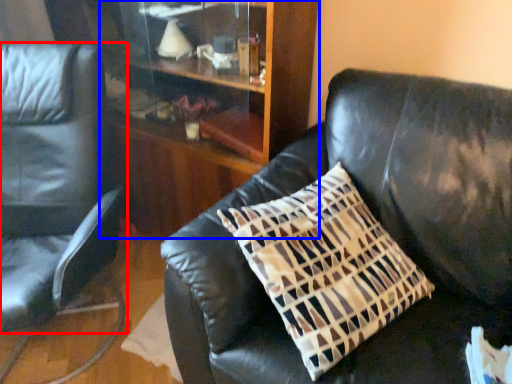
Question: Among these objects, which one is farthest to the camera, chair (highlighted by a red box) or dresser (highlighted by a blue box)?

Choices:
 (A) chair
 (B) dresser

Answer: (B)